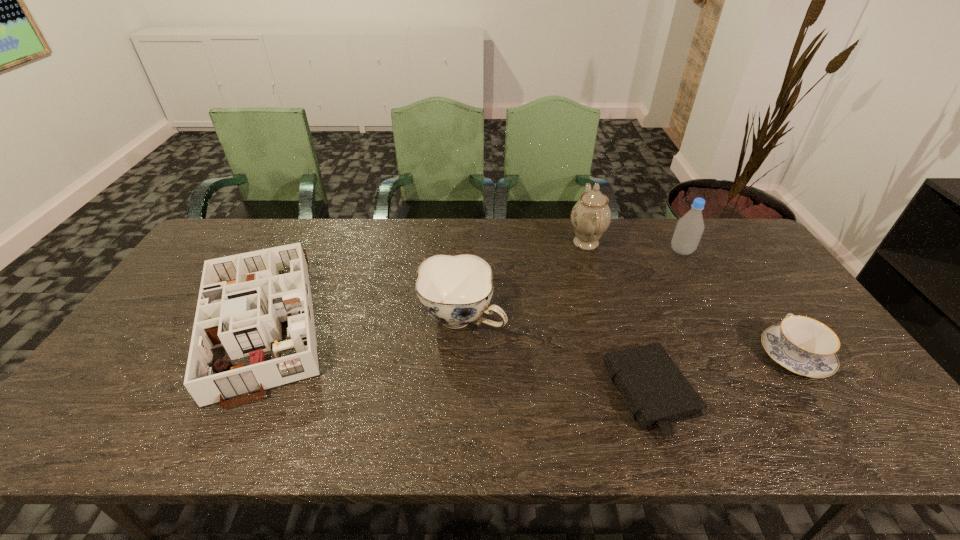
Image resolution: width=960 pixels, height=540 pixels. Identify the location of bottle located at the far edge. (689, 229).

This screenshot has width=960, height=540. I want to click on dollhouse positioned at the far edge, so click(243, 300).

Locate an element on the screen. This screenshot has width=960, height=540. dollhouse present at the near edge is located at coordinates coord(243,300).

Where is `Bible located in the near edge section of the desktop`? The image size is (960, 540). Bible located in the near edge section of the desktop is located at coordinates (658, 394).

At what (x,y) coordinates should I click in order to perform the action: click on object that is positioned at the left edge. Please return your answer as a coordinate pair (x, y). Image resolution: width=960 pixels, height=540 pixels. Looking at the image, I should click on (243, 300).

Find the location of a particular element. Image resolution: width=960 pixels, height=540 pixels. object at the right edge is located at coordinates (802, 345).

I want to click on object at the far left corner, so click(243, 300).

Where is `object at the near left corner`? This screenshot has height=540, width=960. object at the near left corner is located at coordinates (243, 300).

The height and width of the screenshot is (540, 960). In the image, there is a desktop. Find the location of `vacant space at the far edge`. vacant space at the far edge is located at coordinates (510, 244).

Where is `vacant space at the near edge`? The width and height of the screenshot is (960, 540). vacant space at the near edge is located at coordinates (655, 434).